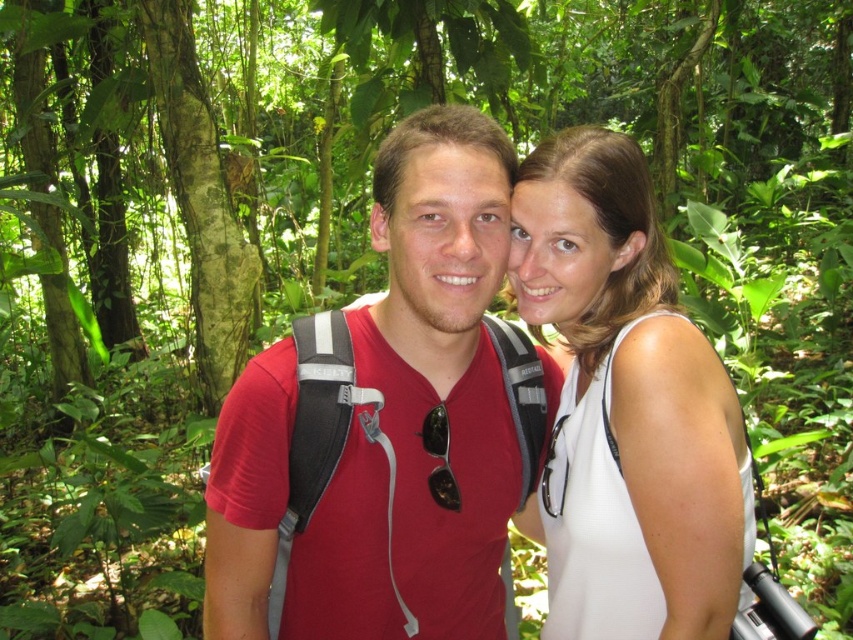
You are a photographer trying to capture a photo of both the matte red shirt at center and the white matte tank top at center. Since you want them both in the frame, which direction should you position your camera relative to the subjects?

The matte red shirt at center is to the left of the white matte tank top at center, so you should position your camera to the left side of the subjects to ensure both are in the frame.

You are a photographer trying to capture a photo of both individuals in the scene. You notice two specific points marked as point 1 and point 2. Point 1 is at coordinates (380, 179) and point 2 is at (665, 582). Based on their positions, which point is closer to you, the photographer?

Point 1 is closer to you than point 2 because the description states that point 1 is further to the viewer than point 2. Wait, there seems to be a contradiction here. Let me check again. The Objects Description says, Point (380, 179) is further to the viewer than point (665, 582). So actually, point 1 is further away from the viewer, meaning point 2 is closer. Hmm, perhaps I made a mistake in the initial answer. Let me correct that. The correct answer should be that point 1 is further away, so point 2,